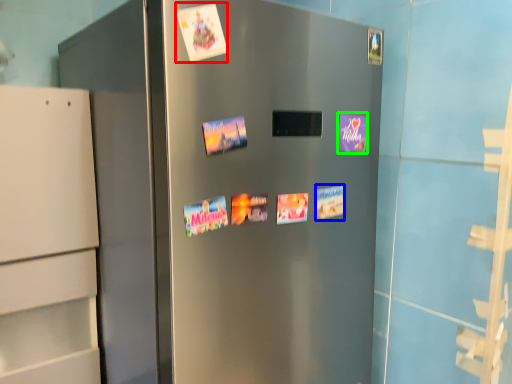
Question: Considering the real-world distances, which object is closest to flyer (highlighted by a red box)? postcard (highlighted by a blue box) or postcard (highlighted by a green box).

Choices:
 (A) postcard
 (B) postcard

Answer: (B)